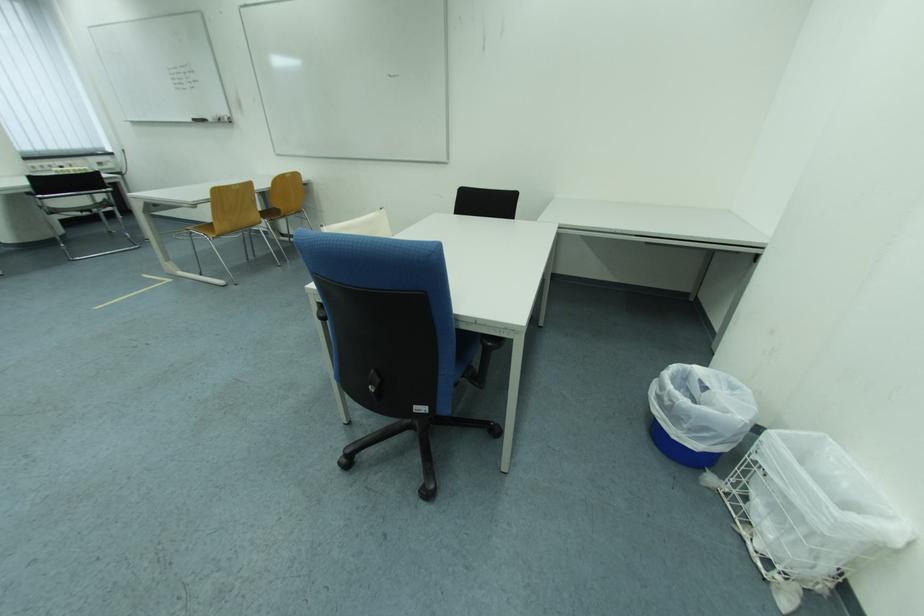
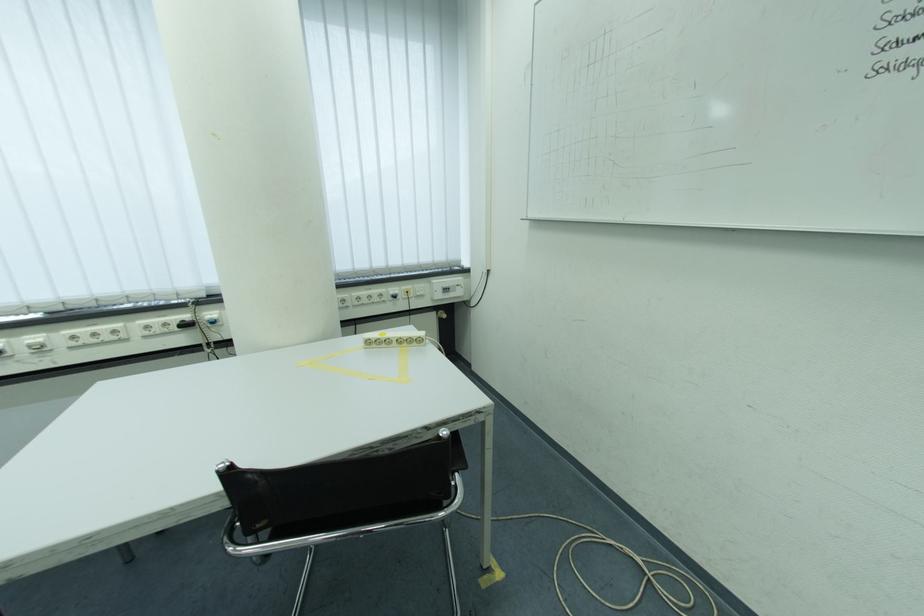
Locate, in the second image, the point that corresponds to point 108,167 in the first image.

(455, 292)